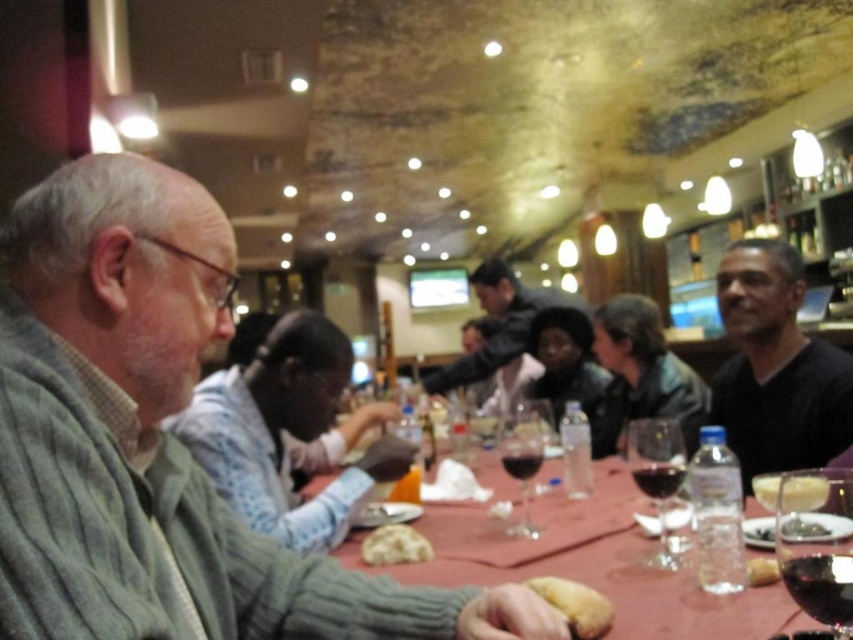
Question: Which object is farther from the camera taking this photo?

Choices:
 (A) white creamy dessert at table center
 (B) smooth yellow bread at lower center

Answer: (A)

Question: Considering the real-world distances, which object is farthest from the green leafy salad at table center?

Choices:
 (A) white fluffy bread at center
 (B) dark gray sweater at center
 (C) light blue sweater at center

Answer: (B)

Question: Is translucent glass wine at table center further to the viewer compared to bread matte at table?

Choices:
 (A) yes
 (B) no

Answer: (A)

Question: Is transparent glass wine glass at table right below dark red glass at table center?

Choices:
 (A) yes
 (B) no

Answer: (B)

Question: Does transparent glass wine at table center appear over dark red glass at lower right?

Choices:
 (A) no
 (B) yes

Answer: (A)

Question: Which point is closer to the camera taking this photo?

Choices:
 (A) (253, 481)
 (B) (524, 337)
 (C) (747, 573)

Answer: (C)